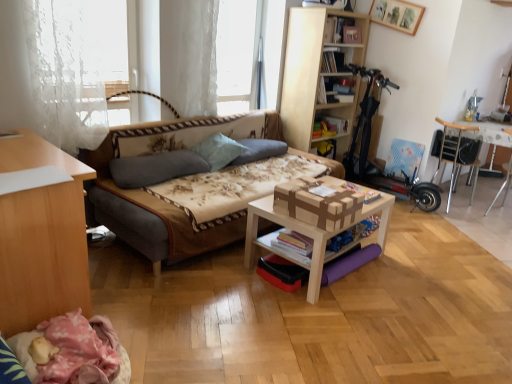
Locate an element on the screen. This screenshot has width=512, height=384. free location in front of light brown wooden table at center, the second table positioned from the back is located at coordinates (325, 325).